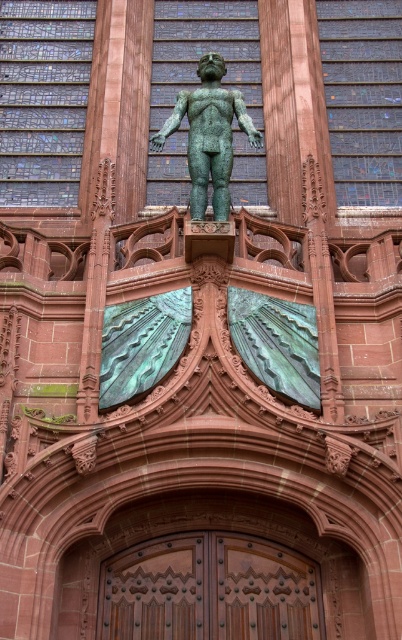
Between polished wood doors at center and green patinated bronze statue at upper center, which one is positioned lower?

polished wood doors at center

Does point (180, 576) come farther from viewer compared to point (203, 67)?

No, it is in front of (203, 67).

Which is behind, point (184, 586) or point (168, 120)?

The point (168, 120) is behind.

Identify the location of polished wood doors at center. The image size is (402, 640). (209, 589).